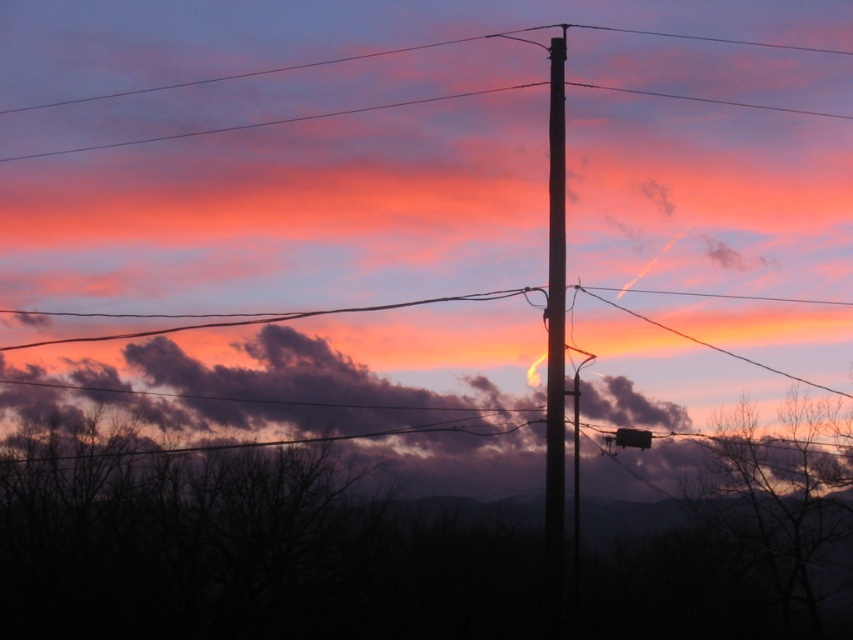
Question: Which point is farther to the camera?

Choices:
 (A) (381, 380)
 (B) (564, 276)

Answer: (A)

Question: Does purple matte cloud at center have a smaller size compared to smooth wood telegraph pole at center?

Choices:
 (A) no
 (B) yes

Answer: (A)

Question: Among these objects, which one is farthest from the camera?

Choices:
 (A) purple matte cloud at center
 (B) smooth wood telegraph pole at center

Answer: (A)

Question: Does purple matte cloud at center lie behind smooth wood telegraph pole at center?

Choices:
 (A) yes
 (B) no

Answer: (A)

Question: Can you confirm if purple matte cloud at center is positioned to the right of smooth wood telegraph pole at center?

Choices:
 (A) no
 (B) yes

Answer: (A)